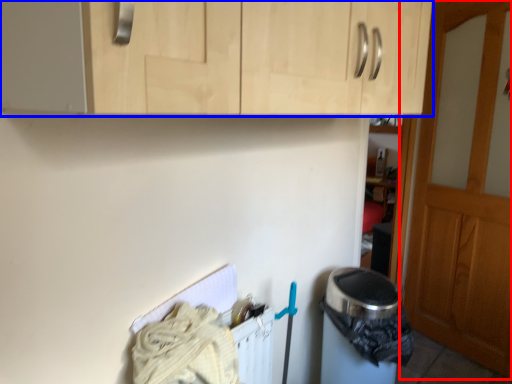
Question: Among these objects, which one is nearest to the camera, door (highlighted by a red box) or cabinetry (highlighted by a blue box)?

Choices:
 (A) door
 (B) cabinetry

Answer: (B)